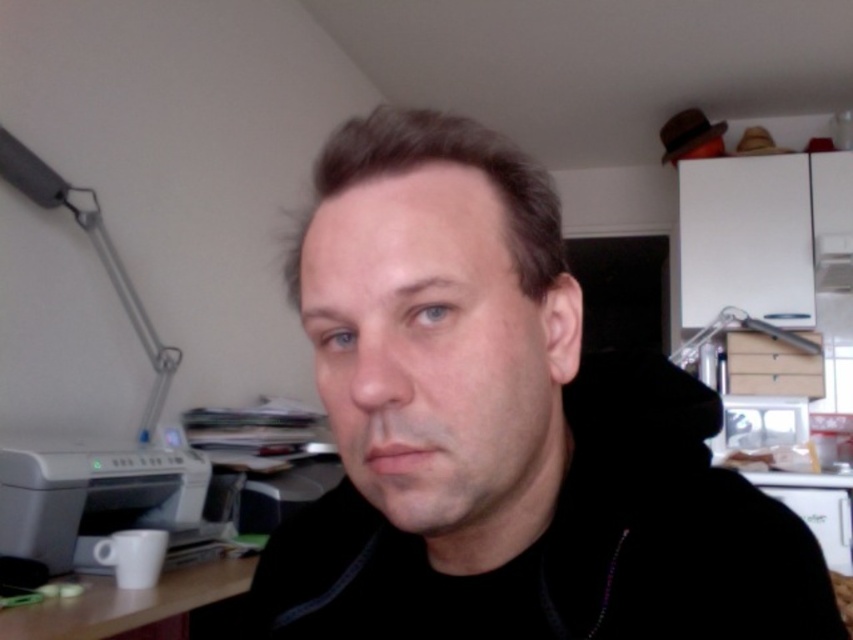
From the picture: You need to place a large document organizer that requires more space than the white plastic printer at lower left. Can it fit on the white matte table at lower left?

The white plastic printer at lower left is bigger than the white matte table at lower left, so the document organizer cannot fit on the white matte table at lower left since the table is smaller than the printer.

You are organizing items in the home office. You need to move the matte gray lamp at upper left to a new location. However, you notice the black matte jacket at center is currently blocking the lamp. Can you move the lamp without moving the jacket?

The black matte jacket at center is in front of the matte gray lamp at upper left, so you cannot move the lamp without moving the jacket first.

You are trying to place a new item on the desk in the scene. You have two points marked on the desk surface at coordinates point (x=639, y=438) and point (x=18, y=547). Which of these points is closer to you as you look at the desk?

Point (x=639, y=438) is closer to the viewer than point (x=18, y=547).